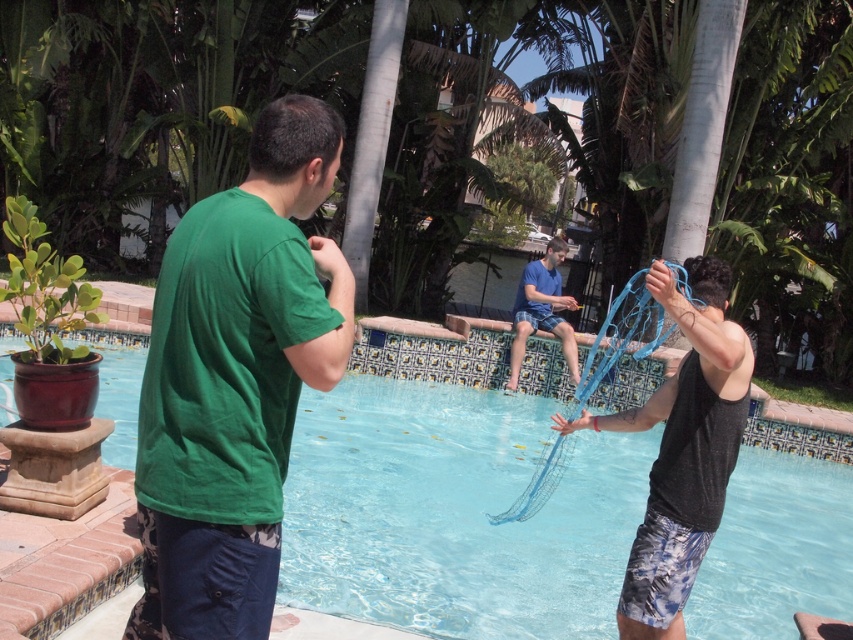
You are standing at the edge of the pool and want to retrieve the black mesh net at right from the transparent blue water at center. If you can reach 8 feet, will you be able to grab it?

The transparent blue water at center is 8.42 feet away from the black mesh net at right. Since your reach is 8 feet, you cannot quite reach the net as it is slightly farther away than your reach.

You are a photographer trying to capture a wide shot of the scene. The green matte shirt at center and the black mesh net at right are both in your frame. Which object takes up more horizontal space in the photo?

The green matte shirt at center takes up more horizontal space in the photo since its width surpasses that of the black mesh net at right.